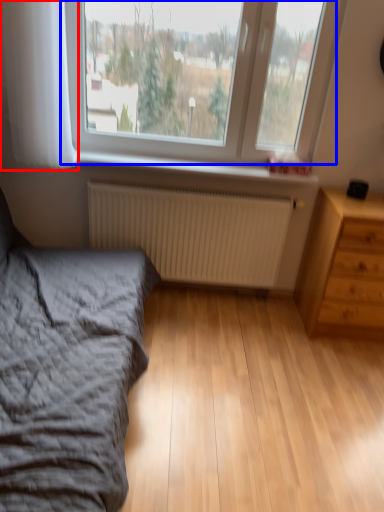
Question: Which point is further to the camera, curtain (highlighted by a red box) or window (highlighted by a blue box)?

Choices:
 (A) curtain
 (B) window

Answer: (B)